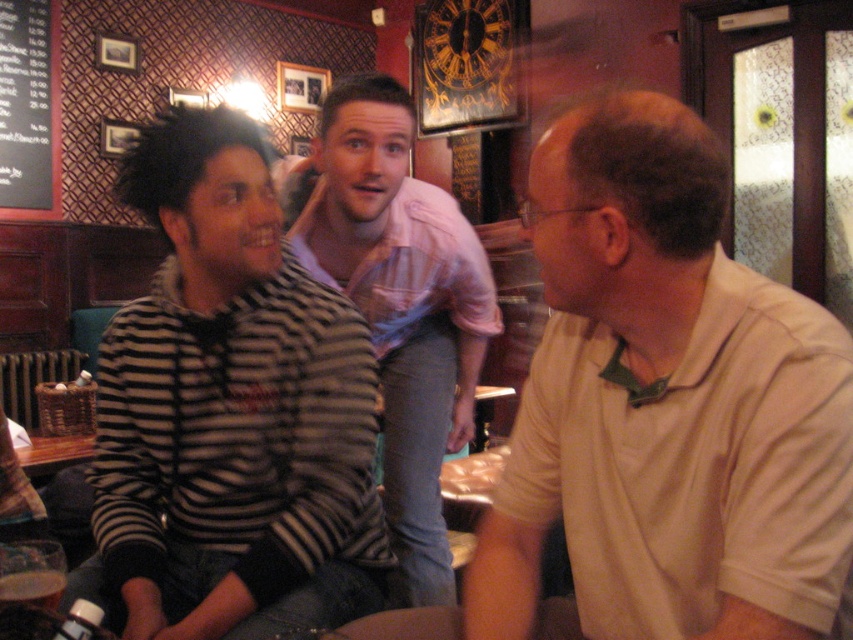
Question: Is light beige shirt at center bigger than brown paper cup at lower left?

Choices:
 (A) yes
 (B) no

Answer: (A)

Question: Among these points, which one is farthest from the camera?

Choices:
 (A) (27, 72)
 (B) (440, 266)
 (C) (27, 573)
 (D) (566, 605)

Answer: (A)

Question: Which is farther from the black chalkboard at upper left?

Choices:
 (A) striped sweater at left
 (B) brown paper cup at lower left

Answer: (B)

Question: Is light beige shirt at center below black chalkboard at upper left?

Choices:
 (A) yes
 (B) no

Answer: (A)

Question: Is light beige shirt at center positioned at the back of brown paper cup at lower left?

Choices:
 (A) no
 (B) yes

Answer: (A)

Question: Which of the following is the farthest from the observer?

Choices:
 (A) (22, 161)
 (B) (206, 129)
 (C) (421, 628)

Answer: (A)